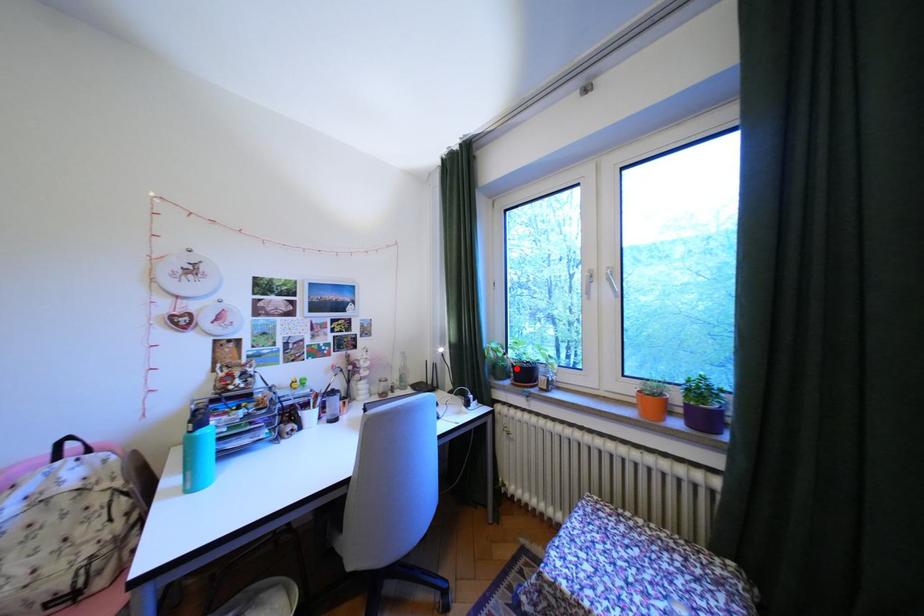
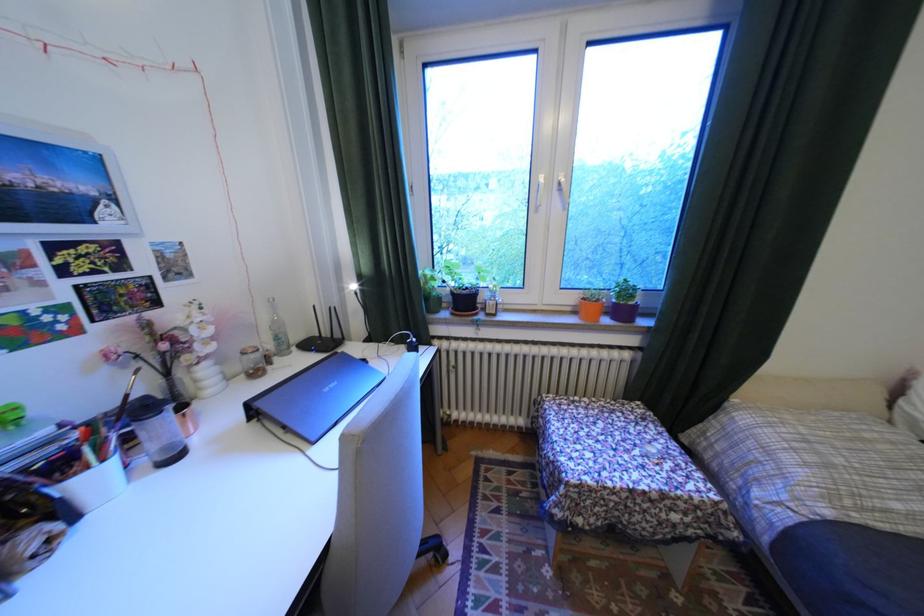
Locate, in the second image, the point that corresponds to the highlighted location in the first image.

(451, 299)